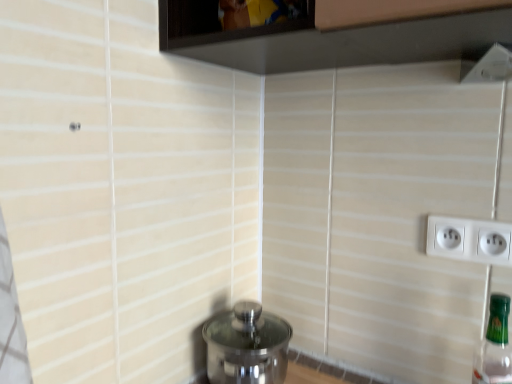
Question: Does transparent glass window at upper center appear on the right side of polished stainless steel water heater at lower center?

Choices:
 (A) yes
 (B) no

Answer: (A)

Question: Can polished stainless steel water heater at lower center be found inside transparent glass window at upper center?

Choices:
 (A) no
 (B) yes

Answer: (A)

Question: Does transparent glass window at upper center come behind polished stainless steel water heater at lower center?

Choices:
 (A) yes
 (B) no

Answer: (B)

Question: Are transparent glass window at upper center and polished stainless steel water heater at lower center far apart?

Choices:
 (A) yes
 (B) no

Answer: (B)

Question: Could you tell me if transparent glass window at upper center is facing polished stainless steel water heater at lower center?

Choices:
 (A) no
 (B) yes

Answer: (A)

Question: From the image's perspective, is transparent glass window at upper center located above or below green glass bottle at right?

Choices:
 (A) below
 (B) above

Answer: (B)

Question: From their relative heights in the image, would you say transparent glass window at upper center is taller or shorter than green glass bottle at right?

Choices:
 (A) tall
 (B) short

Answer: (B)

Question: In the image, is transparent glass window at upper center on the left side or the right side of green glass bottle at right?

Choices:
 (A) left
 (B) right

Answer: (A)

Question: Considering the positions of transparent glass window at upper center and green glass bottle at right in the image, is transparent glass window at upper center wider or thinner than green glass bottle at right?

Choices:
 (A) thin
 (B) wide

Answer: (B)

Question: Considering their positions, is polished stainless steel water heater at lower center located in front of or behind green glass bottle at right?

Choices:
 (A) behind
 (B) front

Answer: (A)

Question: Considering the positions of polished stainless steel water heater at lower center and green glass bottle at right in the image, is polished stainless steel water heater at lower center wider or thinner than green glass bottle at right?

Choices:
 (A) thin
 (B) wide

Answer: (B)

Question: Is polished stainless steel water heater at lower center taller or shorter than green glass bottle at right?

Choices:
 (A) tall
 (B) short

Answer: (B)

Question: Considering the positions of polished stainless steel water heater at lower center and green glass bottle at right in the image, is polished stainless steel water heater at lower center bigger or smaller than green glass bottle at right?

Choices:
 (A) small
 (B) big

Answer: (B)

Question: Is polished stainless steel water heater at lower center situated inside transparent glass window at upper center or outside?

Choices:
 (A) inside
 (B) outside

Answer: (B)

Question: Considering the positions of polished stainless steel water heater at lower center and transparent glass window at upper center in the image, is polished stainless steel water heater at lower center taller or shorter than transparent glass window at upper center?

Choices:
 (A) short
 (B) tall

Answer: (B)